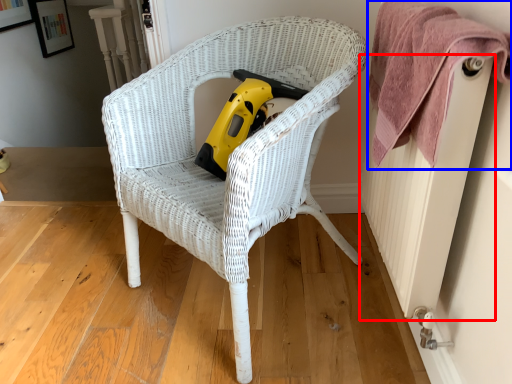
Question: Which object is further to the camera taking this photo, radiator (highlighted by a red box) or towel (highlighted by a blue box)?

Choices:
 (A) radiator
 (B) towel

Answer: (B)